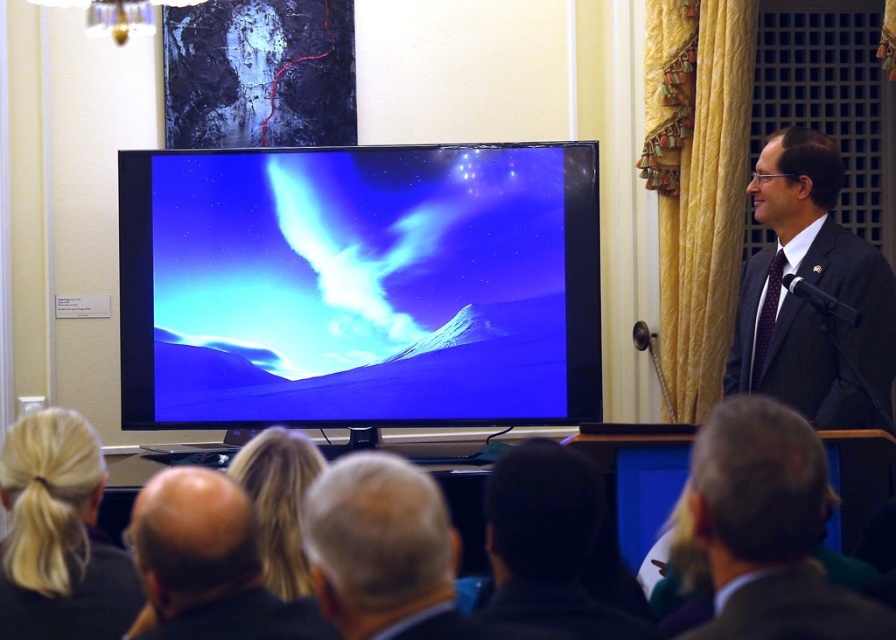
You are standing in the room where the presentation is happening. You notice two points marked on the television screen. The first point is at coordinates point (154, 230) and the second point is at point (192, 580). Which of these two points is closer to you?

Point (192, 580) is closer to you because it is nearer to the camera compared to point (154, 230), which is further away.

You are an attendee at the presentation and need to find the smooth gray suit at right. Where should you look in the room?

The smooth gray suit at right is located at point (768, 529) in the room.

You are standing in the room where the presentation is happening. You notice a specific point marked at coordinates point (768,529). Which object in the scene does this point belong to?

The point (768,529) is on the smooth gray suit at right.